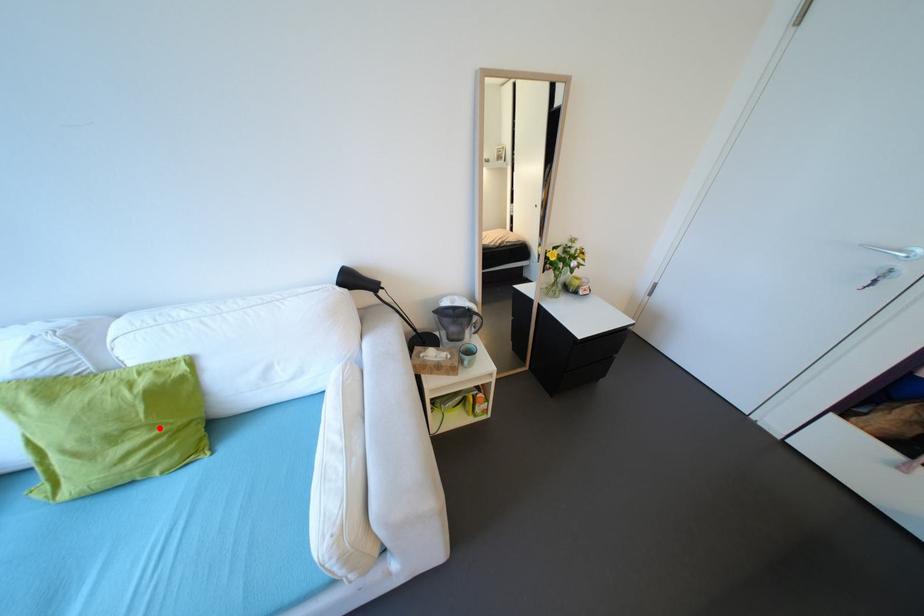
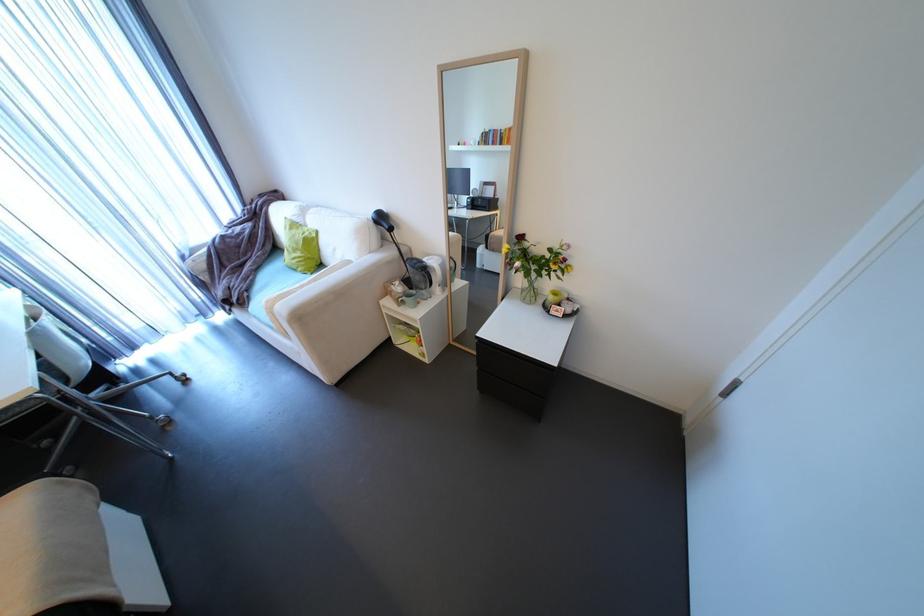
Find the pixel in the second image that matches the highlighted location in the first image.

(310, 253)